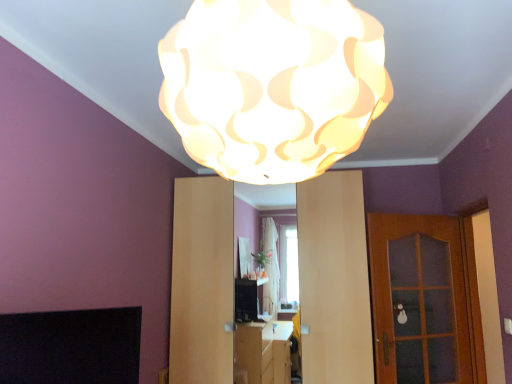
Question: From a real-world perspective, is matte wood dresser at center positioned above or below wooden glass door at right?

Choices:
 (A) below
 (B) above

Answer: (B)

Question: In terms of height, does matte wood dresser at center look taller or shorter compared to wooden glass door at right?

Choices:
 (A) short
 (B) tall

Answer: (B)

Question: Which of these objects is positioned closest to the matte wood dresser at center?

Choices:
 (A) wooden glass door at right
 (B) black matte fireplace at lower left
 (C) white matte lampshade at upper center

Answer: (A)

Question: Which is farther from the black matte fireplace at lower left?

Choices:
 (A) wooden glass door at right
 (B) white matte lampshade at upper center
 (C) matte wood dresser at center

Answer: (A)